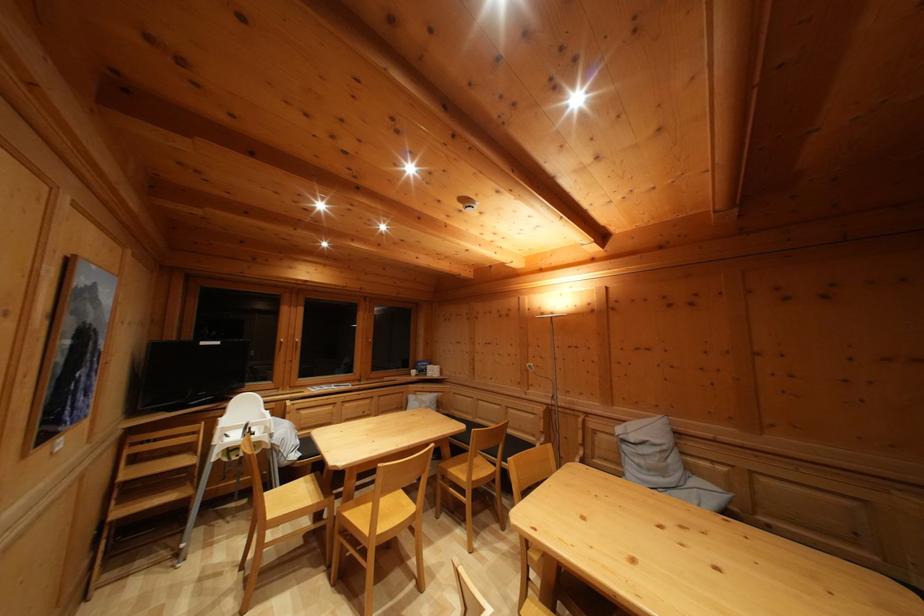
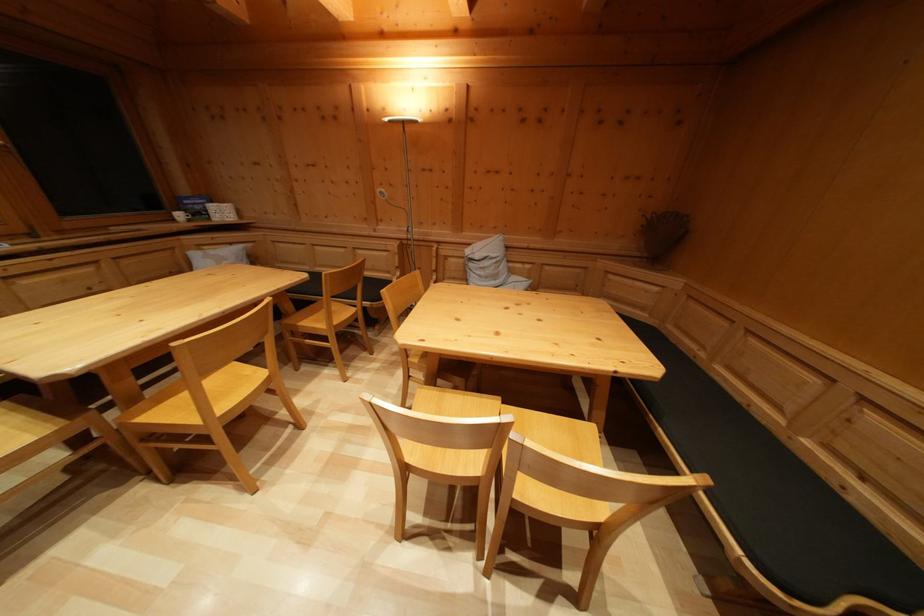
How did the camera likely rotate?

The rotation direction of the camera is right-down.